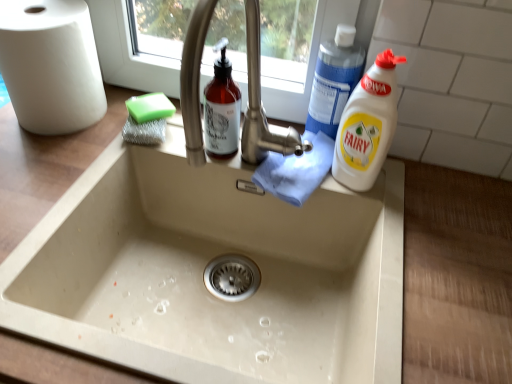
Question: From the image's perspective, is white matte paper towel at left above white plastic bottle at right, the 2th cleaning product positioned from the top?

Choices:
 (A) yes
 (B) no

Answer: (A)

Question: Can you confirm if white matte paper towel at left is positioned to the right of white plastic bottle at right, the 1th cleaning product when ordered from bottom to top?

Choices:
 (A) yes
 (B) no

Answer: (B)

Question: Does white matte paper towel at left lie in front of white plastic bottle at right, the 1th cleaning product when ordered from bottom to top?

Choices:
 (A) yes
 (B) no

Answer: (B)

Question: Is white plastic bottle at right, the 2th cleaning product positioned from the top, at the back of white matte paper towel at left?

Choices:
 (A) no
 (B) yes

Answer: (A)

Question: Is white matte paper towel at left surrounding white plastic bottle at right, the 2th cleaning product positioned from the top?

Choices:
 (A) no
 (B) yes

Answer: (A)

Question: From the image's perspective, is white matte paper towel at left beneath white plastic bottle at right, the 2th cleaning product positioned from the top?

Choices:
 (A) no
 (B) yes

Answer: (A)

Question: From the image's perspective, would you say white matte paper towel at left is shown under blue plastic bottle at upper right, the 1th cleaning product from the top?

Choices:
 (A) no
 (B) yes

Answer: (A)

Question: From the image's perspective, is white matte paper towel at left located above blue plastic bottle at upper right, the 1th cleaning product from the top?

Choices:
 (A) no
 (B) yes

Answer: (B)

Question: Is white matte paper towel at left further to the viewer compared to blue plastic bottle at upper right, the 1th cleaning product from the top?

Choices:
 (A) no
 (B) yes

Answer: (A)

Question: Is white matte paper towel at left wider than blue plastic bottle at upper right, which is counted as the second cleaning product, starting from the bottom?

Choices:
 (A) no
 (B) yes

Answer: (B)

Question: From a real-world perspective, is white matte paper towel at left over blue plastic bottle at upper right, which is counted as the second cleaning product, starting from the bottom?

Choices:
 (A) no
 (B) yes

Answer: (A)

Question: Is white matte paper towel at left in front of blue plastic bottle at upper right, which is counted as the second cleaning product, starting from the bottom?

Choices:
 (A) no
 (B) yes

Answer: (B)

Question: Is blue plastic bottle at upper right, the 1th cleaning product from the top, at the right side of white plastic bottle at right, the 2th cleaning product positioned from the top?

Choices:
 (A) no
 (B) yes

Answer: (A)